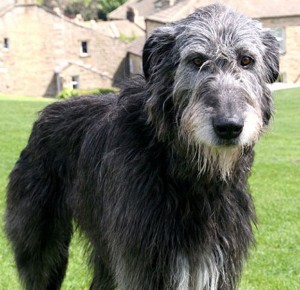
Where is `windows`? This screenshot has height=290, width=300. windows is located at coordinates (84, 49), (5, 40), (75, 84).